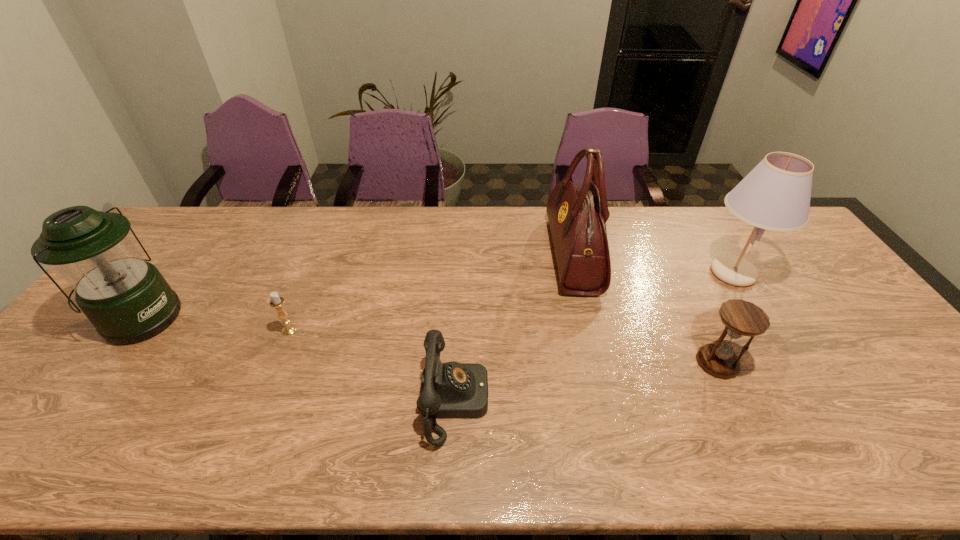
This screenshot has width=960, height=540. Identify the location of vacant area that lies between the telephone and the fifth object from right to left. (372, 366).

At what (x,y) coordinates should I click in order to perform the action: click on vacant space that is in between the third object from right to left and the fourth tallest object. Please return your answer as a coordinate pair (x, y). This screenshot has height=540, width=960. Looking at the image, I should click on (645, 308).

Locate which object is the third closest to the leftmost object. Please provide its 2D coordinates. Your answer should be formatted as a tuple, i.e. [(x, y)], where the tuple contains the x and y coordinates of a point satisfying the conditions above.

[(577, 215)]

You are a GUI agent. You are given a task and a screenshot of the screen. Output one action in this format:
    pyautogui.click(x=<x>, y=<y>)
    Task: Click on the object that can be found as the second closest to the lampshade
    The image size is (960, 540).
    Given the screenshot: What is the action you would take?
    pyautogui.click(x=577, y=215)

Identify the location of vacant space that satisfies the following two spatial constraints: 1. on the back side of the lampshade; 2. on the left side of the lantern. (174, 273).

Locate an element on the screen. The image size is (960, 540). free space that satisfies the following two spatial constraints: 1. on the front-facing side of the third object from right to left; 2. on the right side of the lampshade is located at coordinates (578, 273).

The image size is (960, 540). In order to click on vacant region that satisfies the following two spatial constraints: 1. on the front-facing side of the handbag; 2. on the right side of the hourglass in this screenshot , I will do `click(599, 362)`.

Locate an element on the screen. vacant area that satisfies the following two spatial constraints: 1. on the back side of the lantern; 2. on the left side of the rightmost object is located at coordinates click(174, 273).